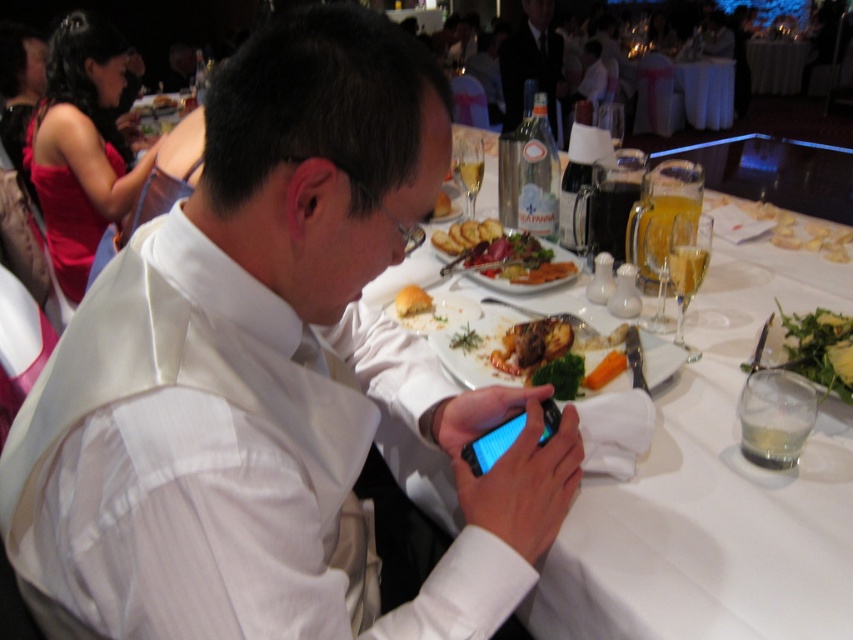
You are a waiter at a formal dinner event. You need to serve a customer who is currently focused on their smartphone. The customer has a golden brown meat at center and a slightly toasted bread at upper center on their table. How far apart are these two items from each other on the table?

The golden brown meat at center and the slightly toasted bread at upper center are 11.89 feet apart from each other.

You are a photographer taking a picture of the scene. You notice two points marked as point 1 at coordinates (519, 104) and point 2 at coordinates (158, 93). Which point will appear closer to the camera in the final photo?

Point 1 at coordinates (519, 104) is further to the camera than point 2 at coordinates (158, 93), so point 1 will appear closer to the camera in the final photo.

What is the exact location of the golden brown meat at center on the table?

The golden brown meat at center is located at point [532,344].